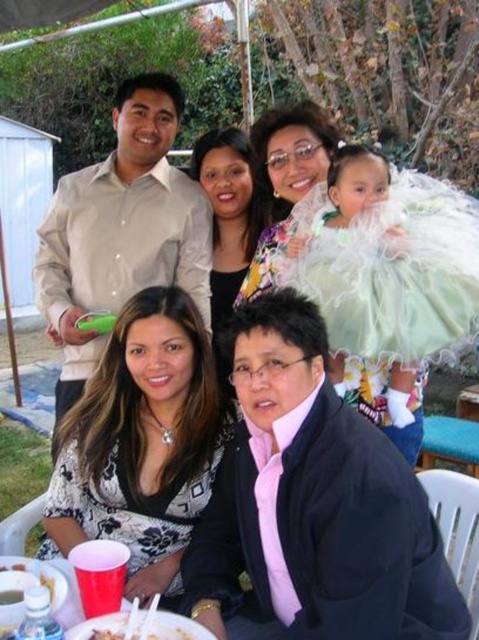
Question: Can you confirm if black matte jacket at lower right is smaller than matte white dress at upper center?

Choices:
 (A) no
 (B) yes

Answer: (A)

Question: Which point appears farthest from the camera in this image?

Choices:
 (A) (172, 109)
 (B) (201, 477)
 (C) (431, 576)

Answer: (A)

Question: Which point is closer to the camera?

Choices:
 (A) (81, 493)
 (B) (182, 234)
 (C) (220, 547)
 (D) (285, 195)

Answer: (C)

Question: Is black matte jacket at lower right closer to the viewer compared to floral-patterned blouse at lower left?

Choices:
 (A) no
 (B) yes

Answer: (B)

Question: Is matte white dress at upper center bigger than floral fabric blouse at center?

Choices:
 (A) no
 (B) yes

Answer: (A)

Question: Which point appears farthest from the camera in this image?

Choices:
 (A) (209, 188)
 (B) (276, 115)
 (C) (56, 342)

Answer: (A)